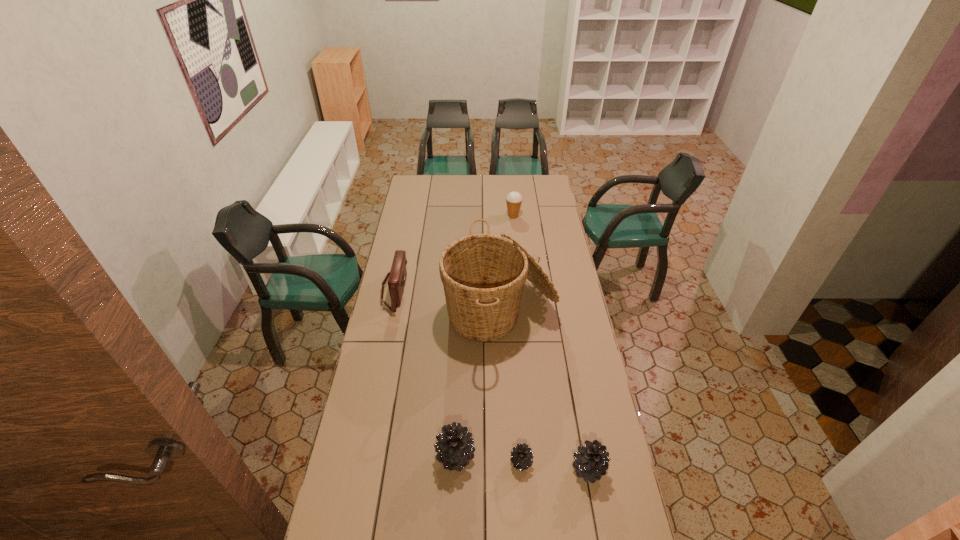
This screenshot has width=960, height=540. In order to click on the leftmost pinecone in this screenshot , I will do `click(454, 446)`.

This screenshot has height=540, width=960. What are the coordinates of `the shortest object` in the screenshot? It's located at (521, 456).

Where is `the second pinecone from left to right`? the second pinecone from left to right is located at coordinates (521, 456).

The width and height of the screenshot is (960, 540). I want to click on the second shortest pinecone, so [591, 463].

This screenshot has width=960, height=540. I want to click on the farthest object, so 514,199.

At what (x,y) coordinates should I click in order to perform the action: click on the tallest object. Please return your answer as a coordinate pair (x, y). Looking at the image, I should click on (483, 275).

The width and height of the screenshot is (960, 540). Find the location of `the leftmost object`. the leftmost object is located at coordinates (397, 276).

You are a GUI agent. You are given a task and a screenshot of the screen. Output one action in this format:
    pyautogui.click(x=<x>, y=<y>)
    Task: Click on the vacant space situated on the front of the leftmost pinecone
    The width and height of the screenshot is (960, 540).
    Given the screenshot: What is the action you would take?
    pyautogui.click(x=452, y=537)

Locate an element on the screen. This screenshot has height=540, width=960. vacant region located 0.130m on the back of the second pinecone from left to right is located at coordinates pos(518,417).

What are the coordinates of `free space located 0.200m on the back of the rightmost pinecone` in the screenshot? It's located at (576, 401).